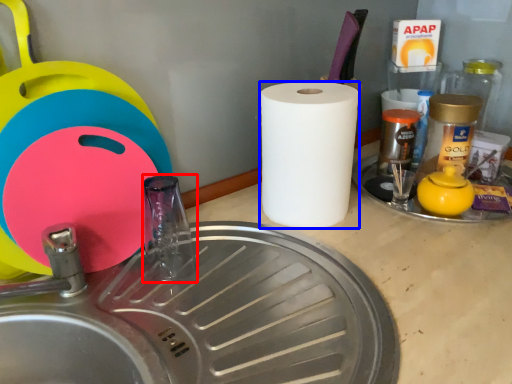
Question: Which point is further to the camera, faucet (highlighted by a red box) or paper towel (highlighted by a blue box)?

Choices:
 (A) faucet
 (B) paper towel

Answer: (B)